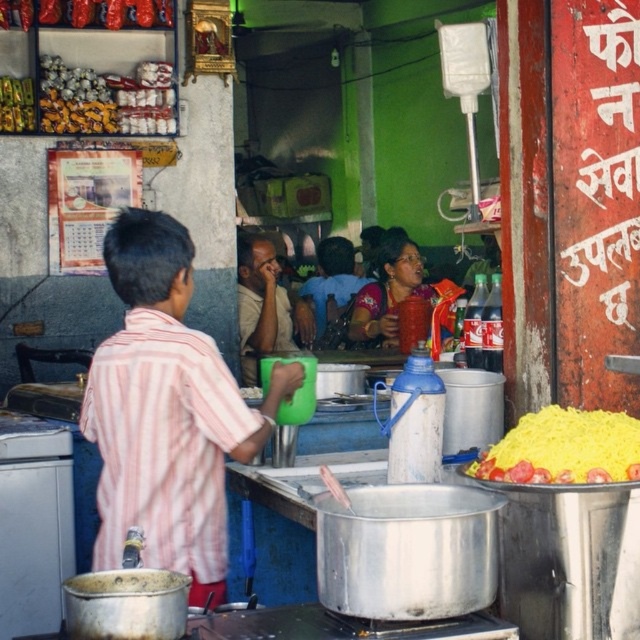
Can you confirm if yellow rice at right is positioned above matte beige shirt at center?

No, yellow rice at right is not above matte beige shirt at center.

Between point (634, 444) and point (273, 320), which one is positioned in front?

Point (634, 444) is more forward.

Is point (515, 435) more distant than point (244, 352)?

That is False.

This screenshot has height=640, width=640. What are the coordinates of `yellow rice at right` in the screenshot? It's located at (563, 449).

Looking at this image, who is lower down, yellow rice at right or matte plastic cup at center?

Positioned lower is yellow rice at right.

Is yellow rice at right above matte plastic cup at center?

No.

Is point (496, 464) closer to camera compared to point (428, 300)?

Yes, it is.

Where is `yellow rice at right`? This screenshot has width=640, height=640. yellow rice at right is located at coordinates (563, 449).

Between matte beige shirt at center and matte plastic cup at center, which one is positioned higher?

Positioned higher is matte plastic cup at center.

Between matte beige shirt at center and matte plastic cup at center, which one is positioned lower?

matte beige shirt at center

Does point (241, 268) come farther from viewer compared to point (394, 276)?

No, (241, 268) is closer to viewer.

You are a GUI agent. You are given a task and a screenshot of the screen. Output one action in this format:
    pyautogui.click(x=<x>, y=<y>)
    Task: Click on the matte beige shirt at center
    The width and height of the screenshot is (640, 640).
    Given the screenshot: What is the action you would take?
    pyautogui.click(x=260, y=304)